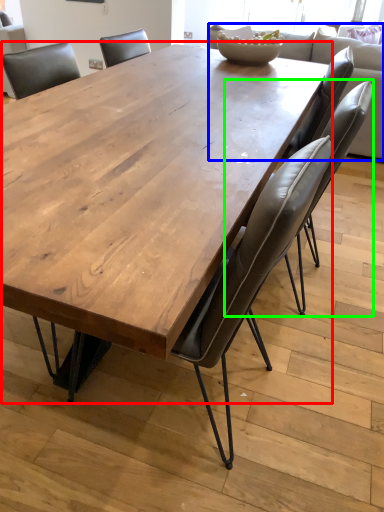
Question: Which object is the closest to the coffee table (highlighted by a red box)? Choose among these: couch (highlighted by a blue box) or chair (highlighted by a green box).

Choices:
 (A) couch
 (B) chair

Answer: (B)